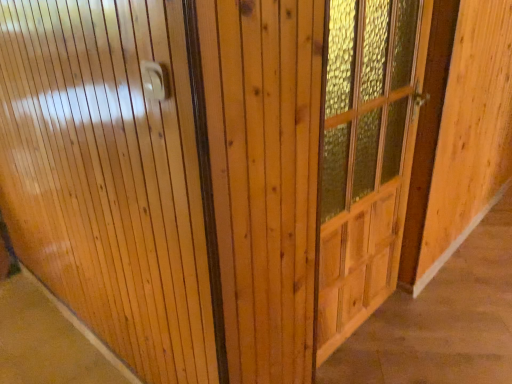
Image resolution: width=512 pixels, height=384 pixels. What do you see at coordinates (366, 156) in the screenshot?
I see `wooden textured door at center` at bounding box center [366, 156].

Where is `wooden textured door at center`? wooden textured door at center is located at coordinates (366, 156).

Identify the location of wooden textured door at center. (366, 156).